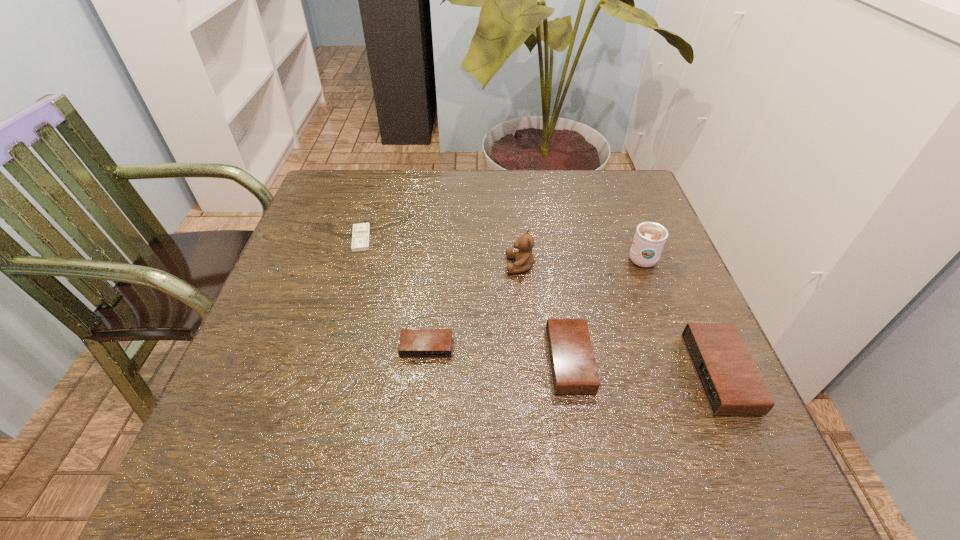
You are a GUI agent. You are given a task and a screenshot of the screen. Output one action in this format:
    pyautogui.click(x=<x>, y=<y>)
    Task: Click on the vacant space situated 0.140m on the front face of the third object from right to left
    This screenshot has width=960, height=540.
    Given the screenshot: What is the action you would take?
    pyautogui.click(x=662, y=360)

At what (x,y) coordinates should I click in order to perform the action: click on vacant space situated 0.250m on the front face of the rightmost alarm clock. Please return your answer as a coordinate pair (x, y). Looking at the image, I should click on (562, 374).

Locate an element on the screen. vacant point located 0.370m on the front face of the rightmost alarm clock is located at coordinates (497, 374).

The height and width of the screenshot is (540, 960). I want to click on free region located on the front face of the rightmost alarm clock, so click(605, 374).

What are the coordinates of `vacant space located 0.330m on the front-facing side of the teddy bear` in the screenshot? It's located at (364, 265).

Image resolution: width=960 pixels, height=540 pixels. Find the location of `free spot located 0.400m on the front-facing side of the teddy bear`. free spot located 0.400m on the front-facing side of the teddy bear is located at coordinates (x=334, y=265).

Locate an element on the screen. The height and width of the screenshot is (540, 960). vacant space located 0.080m on the front-facing side of the teddy bear is located at coordinates (471, 265).

Locate an element on the screen. vacant area located on the right of the shortest object is located at coordinates (393, 239).

Find the location of a particular element. The width and height of the screenshot is (960, 540). vacant area situated 0.070m on the side with the handle of the tallest object is located at coordinates (629, 225).

Find the location of a particular element. The width and height of the screenshot is (960, 540). vacant space located 0.170m on the side with the handle of the tallest object is located at coordinates (620, 202).